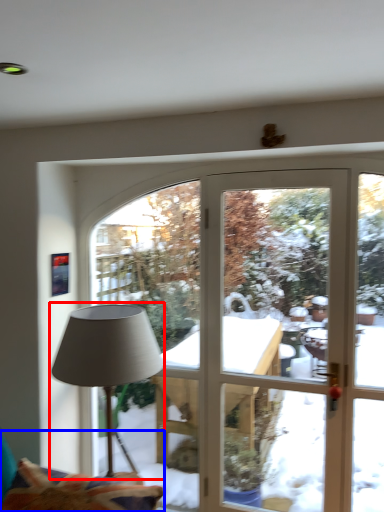
Question: Which object appears farthest to the camera in this image, lamp (highlighted by a red box) or swivel chair (highlighted by a blue box)?

Choices:
 (A) lamp
 (B) swivel chair

Answer: (A)